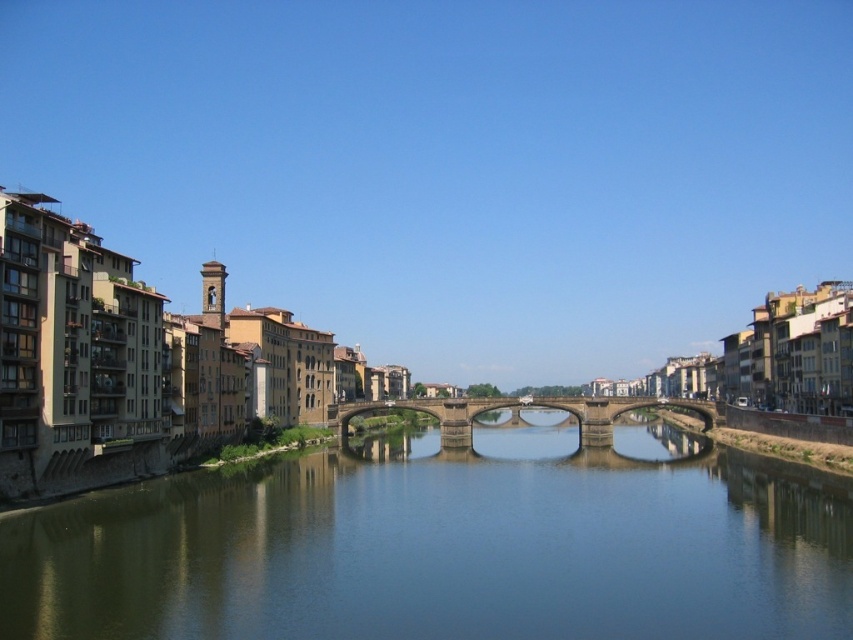
Question: Is greenish-blue water at center above stone bridge at center?

Choices:
 (A) no
 (B) yes

Answer: (A)

Question: Which point is closer to the camera?

Choices:
 (A) (525, 403)
 (B) (172, 490)

Answer: (B)

Question: Can you confirm if greenish-blue water at center is smaller than stone bridge at center?

Choices:
 (A) yes
 (B) no

Answer: (B)

Question: Is greenish-blue water at center wider than stone bridge at center?

Choices:
 (A) no
 (B) yes

Answer: (B)

Question: Which of the following is the farthest from the observer?

Choices:
 (A) tap(717, 634)
 (B) tap(476, 413)

Answer: (B)

Question: Which object appears farthest from the camera in this image?

Choices:
 (A) stone bridge at center
 (B) greenish-blue water at center

Answer: (A)